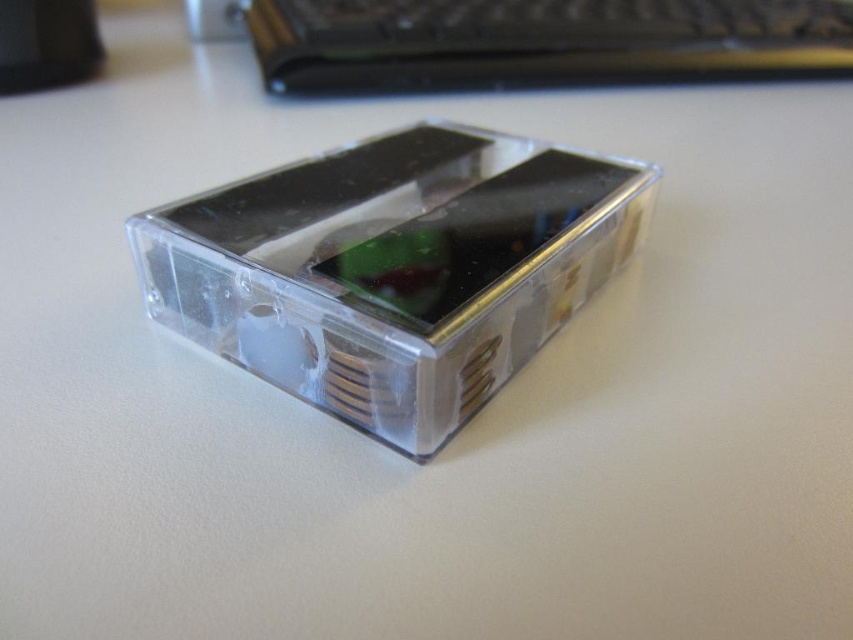
You are examining two electronic devices in a transparent enclosure. The transparent plastic smartphone at center and the clear plastic computer at center are both visible. Which device is taller?

The transparent plastic smartphone at center is taller than the clear plastic computer at center.